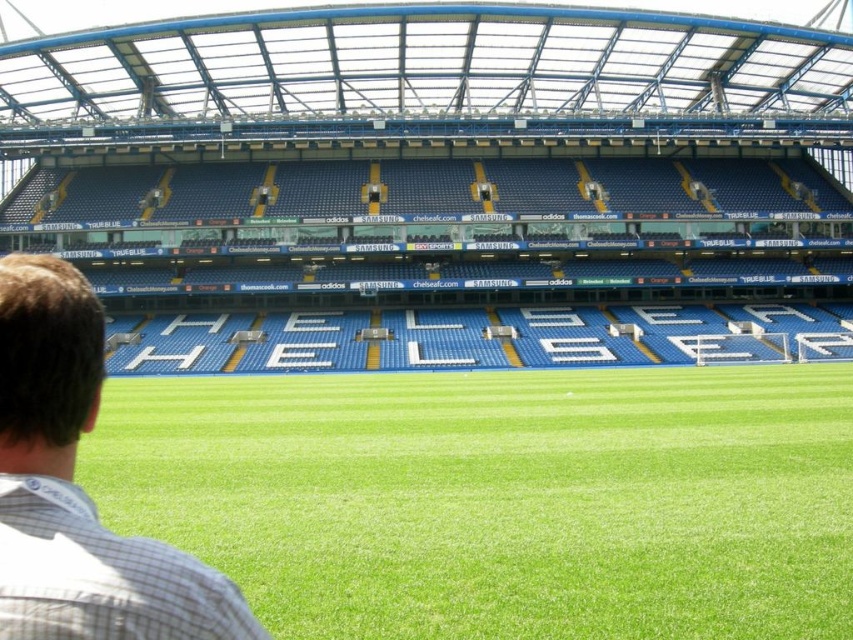
You are standing at the point closest to the front of the stadium seating area. There are two points marked in the image, one at coordinates point (109, 524) and another at point (59, 460). Which point is farther away from your current position?

Point (109, 524) is behind point (59, 460), so the point farther away from your current position is point (109, 524).

You are a spectator sitting in the stadium and want to locate the green grass at center and the brown checkered shirt at lower left. From your seat, which object is positioned to the right?

The green grass at center is to the right of the brown checkered shirt at lower left, so the green grass at center is positioned to the right.